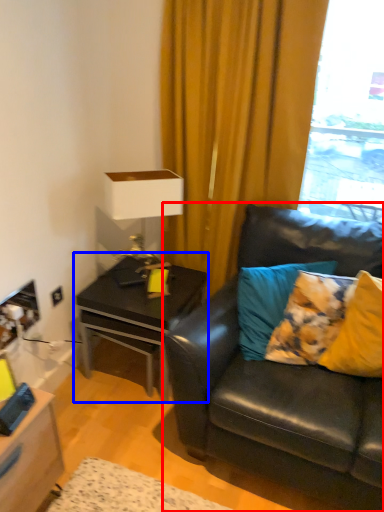
Question: Which object appears closest to the camera in this image, studio couch (highlighted by a red box) or table (highlighted by a blue box)?

Choices:
 (A) studio couch
 (B) table

Answer: (A)